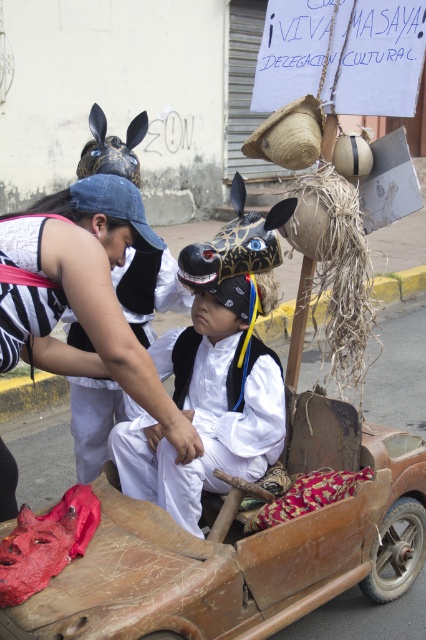
You are a costume designer observing the two white garments at the center of the image. Which garment reaches higher up the body, the white cotton shirt at center or the white matte vest at center?

The white cotton shirt at center has a greater height compared to the white matte vest at center, so the white cotton shirt at center reaches higher up the body.

You are a photographer trying to capture the scene. You want to ensure both the white cotton shirt at center and the white matte vest at center are visible in your photo. Which one should you focus on first to ensure they are both in frame?

The white cotton shirt at center is positioned on the left side of the white matte vest at center, so focusing on the white cotton shirt at center first will help ensure both are in frame as you adjust the camera.

In the scene shown: You are a costume designer preparing for a play. You have two costume pieces to choose from for the main character. The first is the white cotton shirt at center, and the second is the white matte vest at center. The character needs a costume that is more formfitting. Which one should you select?

The white cotton shirt at center is thinner than the white matte vest at center, so the white cotton shirt at center is more formfitting and should be selected.